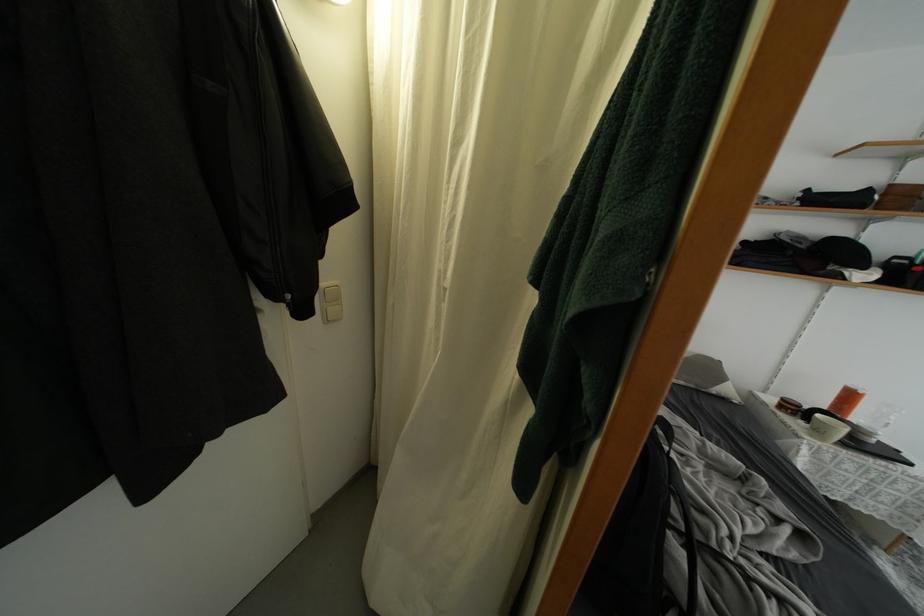
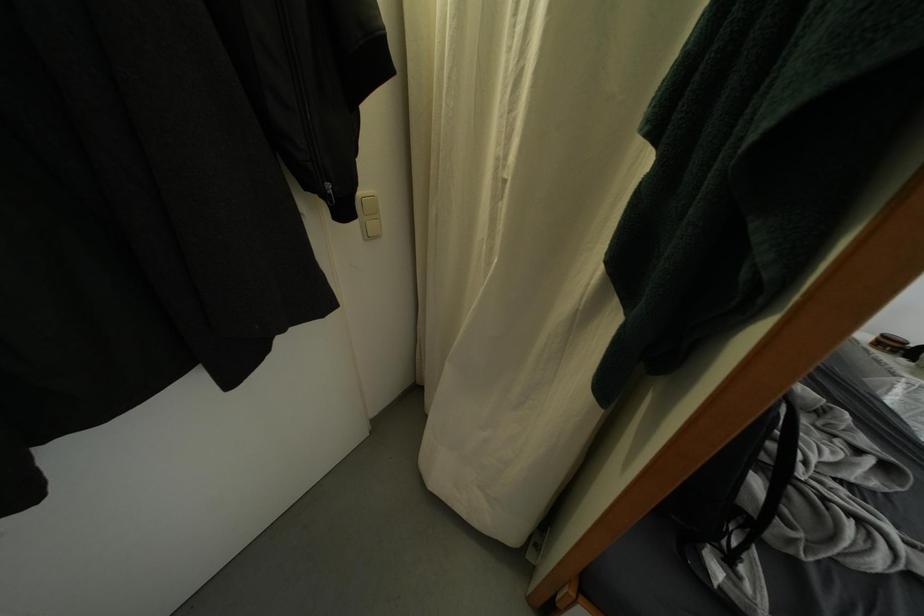
Find the pixel in the second image that matches pixel 786 411 in the first image.

(884, 347)